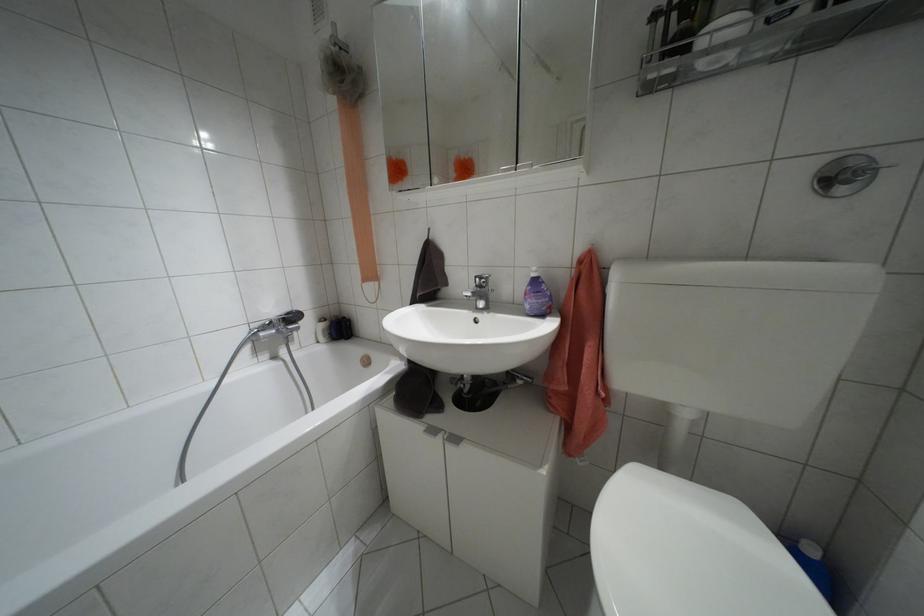
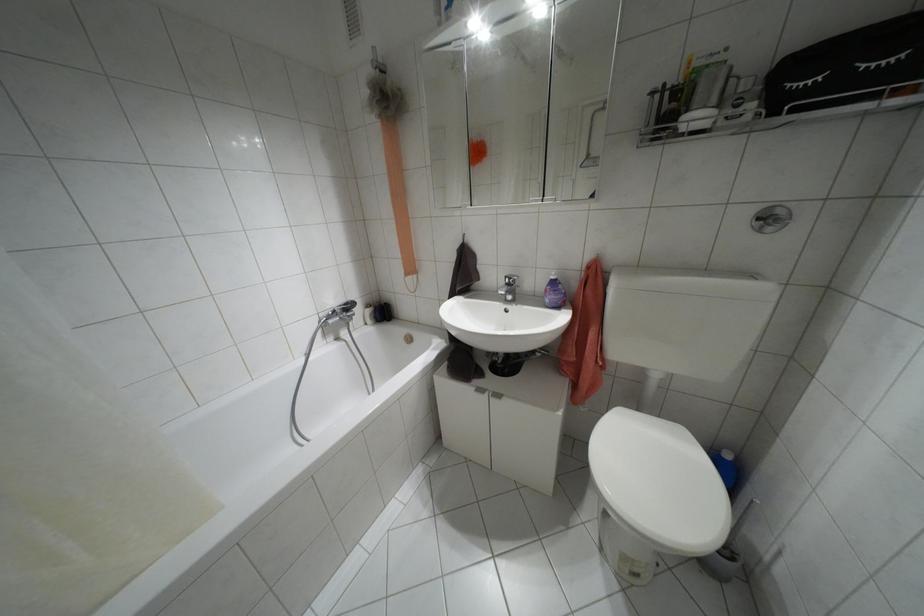
Locate, in the second image, the point that corresponds to point (321, 318) in the first image.

(367, 305)